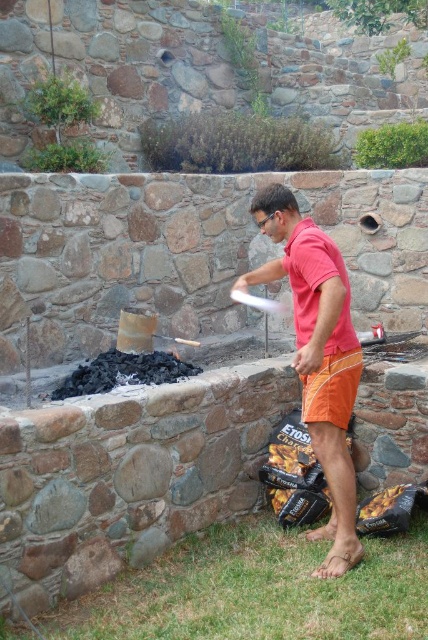
You are planning to cook a meal using the black charcoal at lower left and the orange fabric shorts at center. Which object is bigger?

The black charcoal at lower left is larger in size compared to the orange fabric shorts at center.

You are a drone operator who needs to deliver a package from the matte red shirt at center to the black charcoal at lower left. What is the minimum distance you need to fly the drone to reach the destination?

The minimum distance the drone needs to fly is 1.77 meters between matte red shirt at center and black charcoal at lower left.

You are a guest at a barbecue and need to identify the items in the scene. Which object is bigger between the matte red shirt at center and the black charcoal at lower left?

The matte red shirt at center is larger in size than the black charcoal at lower left.